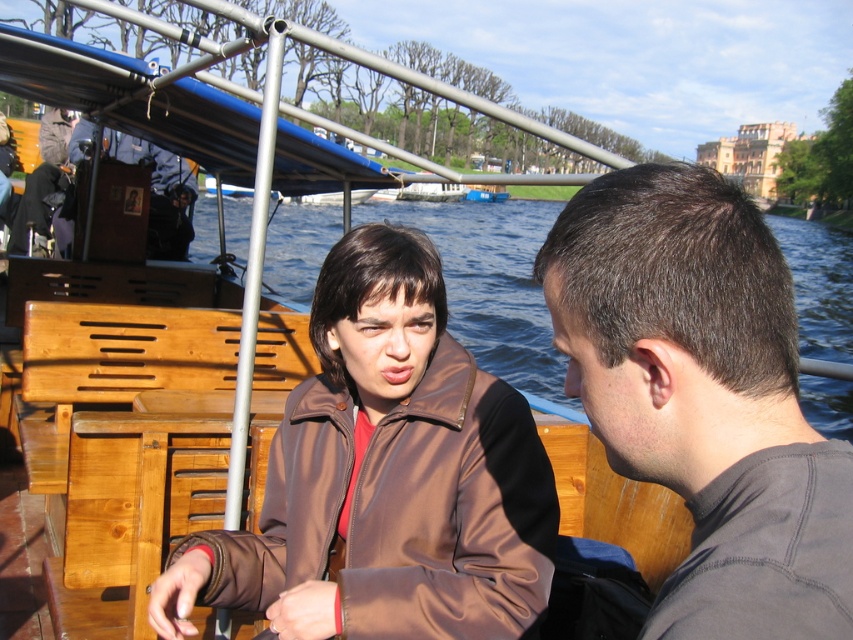
Which is more to the right, brown satin jacket at center or dark brown hair at right?

From the viewer's perspective, dark brown hair at right appears more on the right side.

Identify the location of brown satin jacket at center. The height and width of the screenshot is (640, 853). (386, 476).

The height and width of the screenshot is (640, 853). What do you see at coordinates (386, 476) in the screenshot? I see `brown satin jacket at center` at bounding box center [386, 476].

You are a GUI agent. You are given a task and a screenshot of the screen. Output one action in this format:
    pyautogui.click(x=<x>, y=<y>)
    Task: Click on the brown satin jacket at center
    
    Given the screenshot: What is the action you would take?
    pyautogui.click(x=386, y=476)